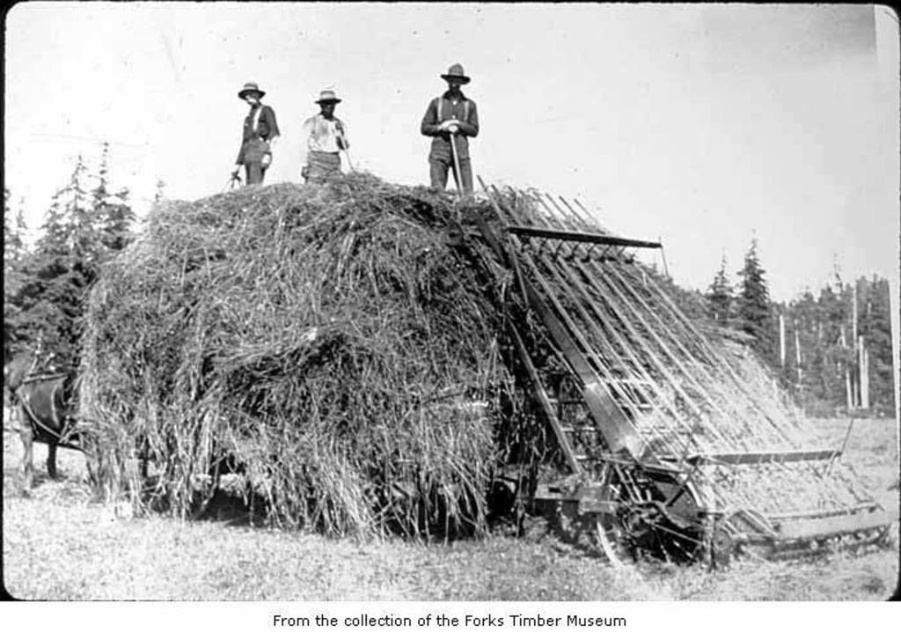
Question: In this image, where is smooth wooden stick at upper center located relative to light brown wooden hat at center?

Choices:
 (A) above
 (B) below

Answer: (B)

Question: Which point is closer to the camera?

Choices:
 (A) dark brown leather horse at lower left
 (B) rugged brown leather hat at upper center

Answer: (A)

Question: Which point is farther to the camera?

Choices:
 (A) (67, 410)
 (B) (433, 140)
 (C) (317, 180)
 (D) (242, 131)

Answer: (D)

Question: Which is nearer to the smooth wooden stick at upper center?

Choices:
 (A) rugged brown suit at upper center
 (B) rugged brown leather hat at upper center

Answer: (B)

Question: Is smooth wooden stick at upper center to the right of light brown wooden hat at center from the viewer's perspective?

Choices:
 (A) no
 (B) yes

Answer: (B)

Question: Is light brown wooden hat at center thinner than rugged brown suit at upper center?

Choices:
 (A) yes
 (B) no

Answer: (A)